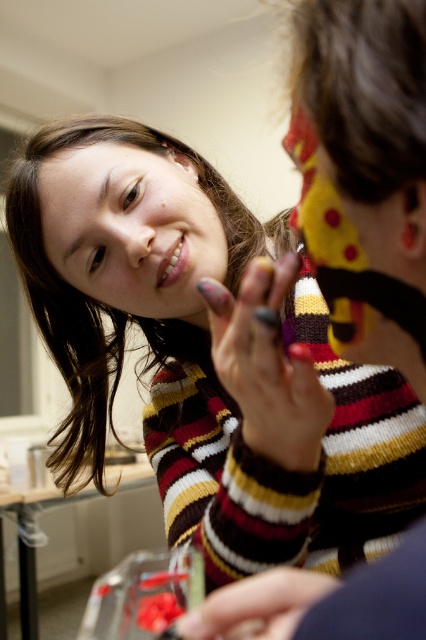
Can you confirm if matte skin face at upper left is wider than matte white lipstick at lower center?

Indeed, matte skin face at upper left has a greater width compared to matte white lipstick at lower center.

Who is higher up, matte skin face at upper left or matte white lipstick at lower center?

Positioned higher is matte skin face at upper left.

Describe the element at coordinates (132, 228) in the screenshot. I see `matte skin face at upper left` at that location.

At what (x,y) coordinates should I click in order to perform the action: click on matte skin face at upper left. Please return your answer as a coordinate pair (x, y). Looking at the image, I should click on (132, 228).

Between matte striped sweater at center and matte white lipstick at lower center, which one is positioned lower?

Positioned lower is matte striped sweater at center.

I want to click on matte striped sweater at center, so click(365, 172).

Between matte striped sweater at center and matte skin face at upper left, which one has more height?

Standing taller between the two is matte striped sweater at center.

Where is `matte striped sweater at center`? matte striped sweater at center is located at coordinates (365, 172).

Where is `matte striped sweater at center`? The width and height of the screenshot is (426, 640). matte striped sweater at center is located at coordinates (365, 172).